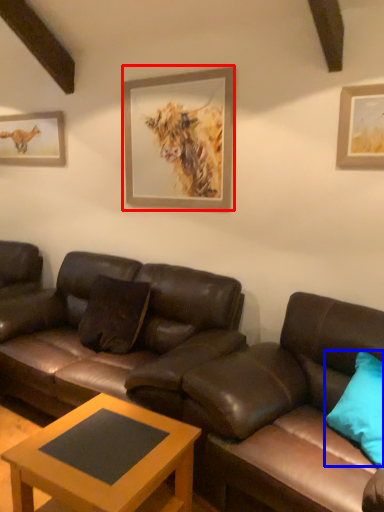
Question: Which object appears closest to the camera in this image, picture frame (highlighted by a red box) or pillow (highlighted by a blue box)?

Choices:
 (A) picture frame
 (B) pillow

Answer: (B)